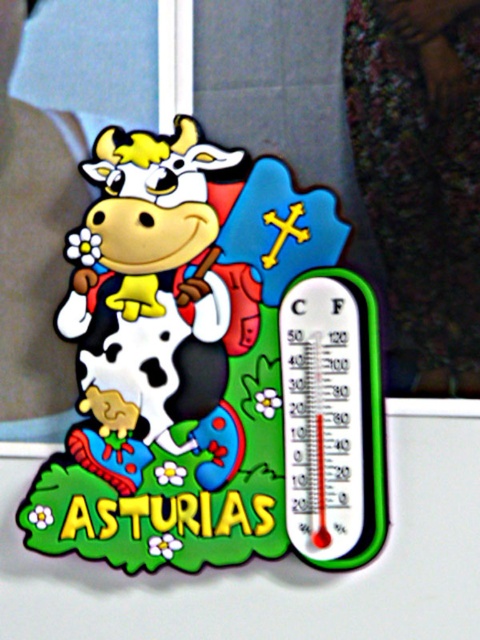
You are a visitor at a souvenir shop in Asturias and see the matte plastic cow at center and the transparent plastic thermometer at right. Which object is closer to you?

The matte plastic cow at center is closer to you because it is in front of the transparent plastic thermometer at right.

You are an architect designing a new Asturian cultural center. You need to place two decorative points on the wall following the design of the thermometer. The first point is at coordinates point (x=227, y=180) and the second at point (x=310, y=371). According to the thermometer design, which point is closer to the observer?

Point (x=227, y=180) is behind point (x=310, y=371), so the point closer to the observer is point (x=310, y=371).